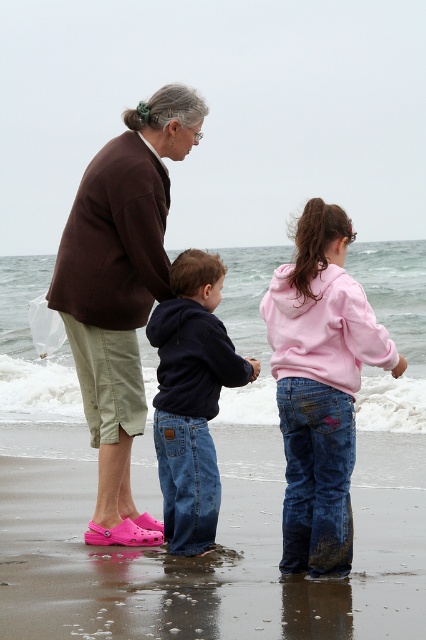
Question: Can you confirm if brown fabric jacket at upper left is wider than pink fleece sweatshirt at center?

Choices:
 (A) no
 (B) yes

Answer: (B)

Question: Which of the following is the closest to the observer?

Choices:
 (A) (317, 556)
 (B) (146, 515)
 (C) (388, 563)
 (D) (176, 547)

Answer: (A)

Question: Which of the following is the closest to the observer?

Choices:
 (A) dark blue hoodie at center
 (B) brown fabric jacket at upper left

Answer: (A)

Question: From the image, what is the correct spatial relationship of pink rubber shoes at lower left in relation to pink fleece sweatshirt at center?

Choices:
 (A) below
 (B) above

Answer: (A)

Question: Can you confirm if brown fabric jacket at upper left is smaller than dark blue hoodie at center?

Choices:
 (A) no
 (B) yes

Answer: (A)

Question: Which object is the farthest from the dark blue hoodie at center?

Choices:
 (A) pink fleece sweatshirt at center
 (B) pink rubber shoes at lower left
 (C) brown fabric jacket at upper left

Answer: (B)